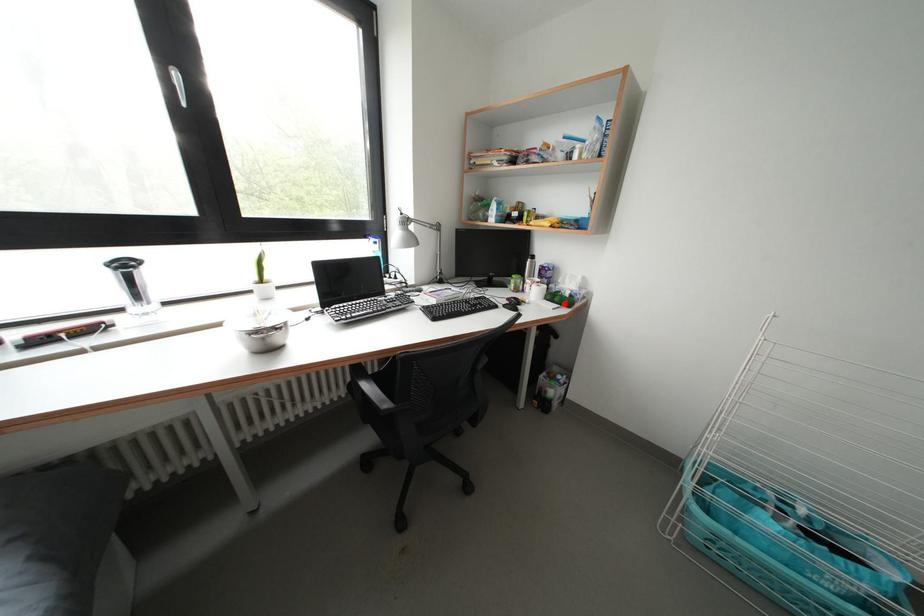
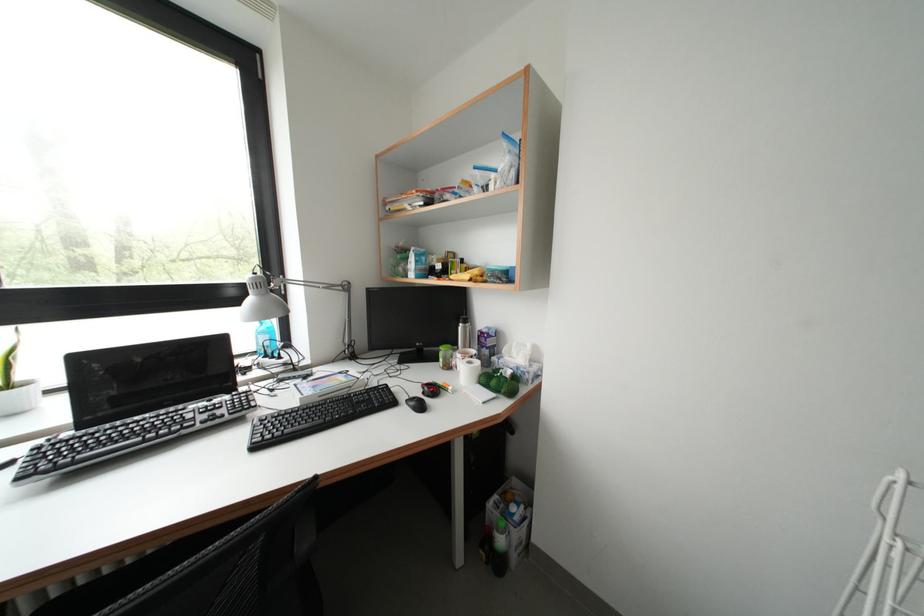
The point at the highlighted location is marked in the first image. Where is the corresponding point in the second image?

(500, 387)